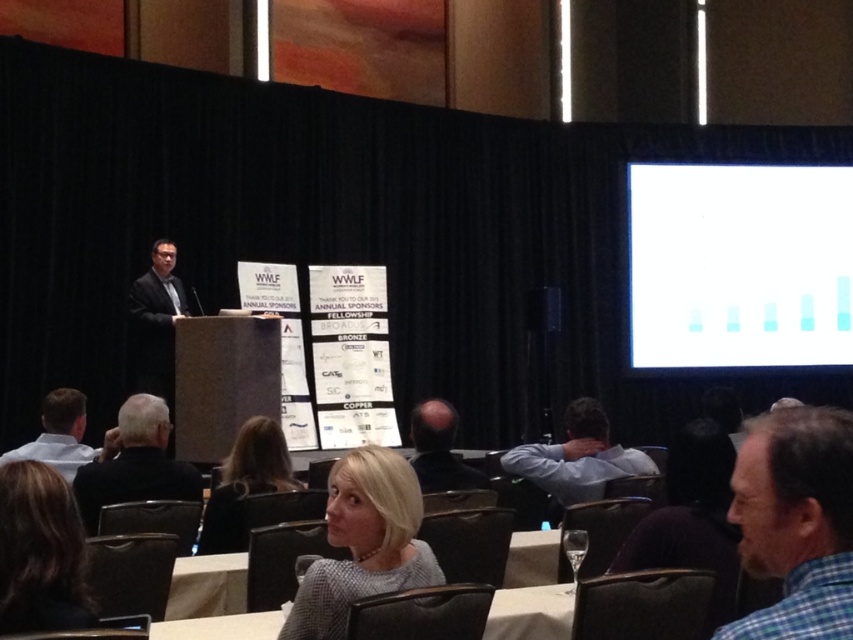
You are an attendee sitting in the front row, and you want to take a photo of the white matte graph at upper right and the light blue shirt at center. Your camera can focus on objects within a 5 meter range. Can you capture both in one shot without moving?

The white matte graph at upper right is 5.91 meters from the light blue shirt at center, which exceeds the camera focus range of 5 meters. Therefore, you cannot capture both in one shot without moving.

You are an event photographer at the conference. You want to capture a photo of the speaker that includes both the blonde hair at lower left and the light blue shirt at center. Which object should you focus on first to ensure both are in frame?

You should focus on the light blue shirt at center first because it is larger and will be easier to frame, ensuring the smaller blonde hair at lower left is also included in the shot.

You are an attendee sitting at the front row of the conference. You want to take a photo of the white matte graph at upper right with your phone. The phone camera has a maximum zoom range of 10 meters. Will you be able to capture the graph clearly without moving closer?

The white matte graph at upper right is 10.44 meters away from the viewer. Since the phone camera can only zoom up to 10 meters, you won let the graph be captured clearly without moving closer.